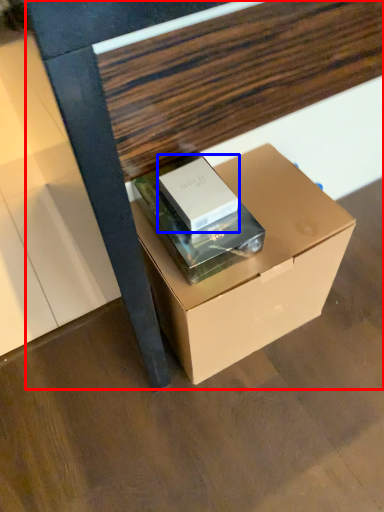
Question: Which object is closer to the camera taking this photo, furniture (highlighted by a red box) or box (highlighted by a blue box)?

Choices:
 (A) furniture
 (B) box

Answer: (A)